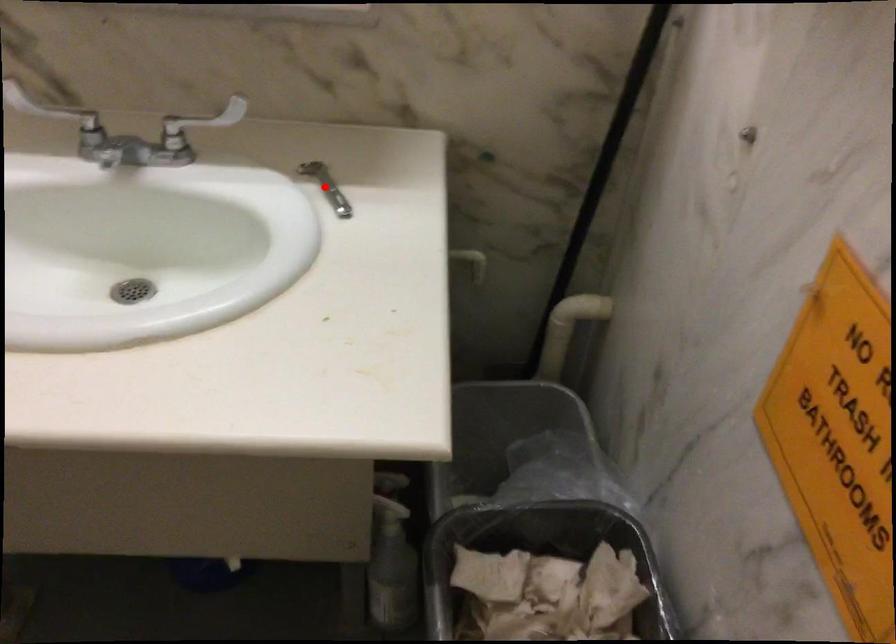
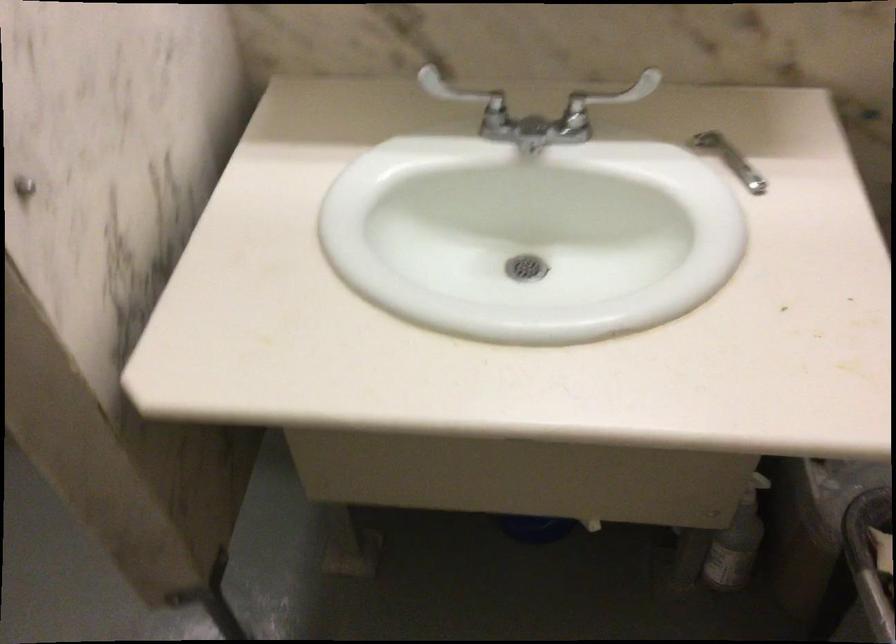
In the second image, find the point that corresponds to the highlighted location in the first image.

(729, 158)